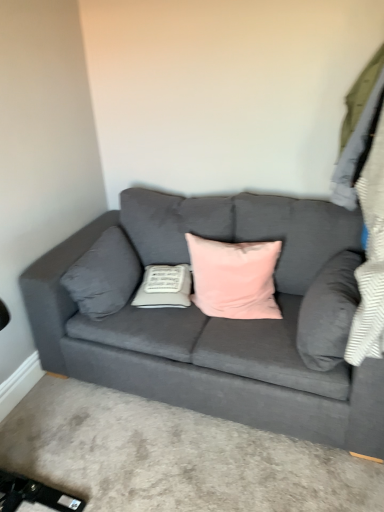
The width and height of the screenshot is (384, 512). I want to click on vacant area on top of velvet gray pillow at right, the fourth pillow from the left (from a real-world perspective), so click(345, 267).